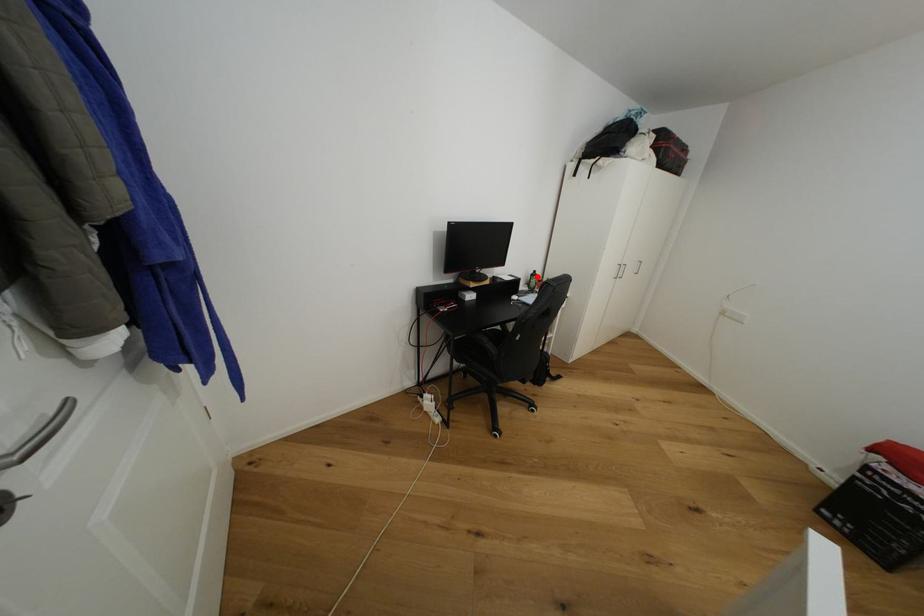
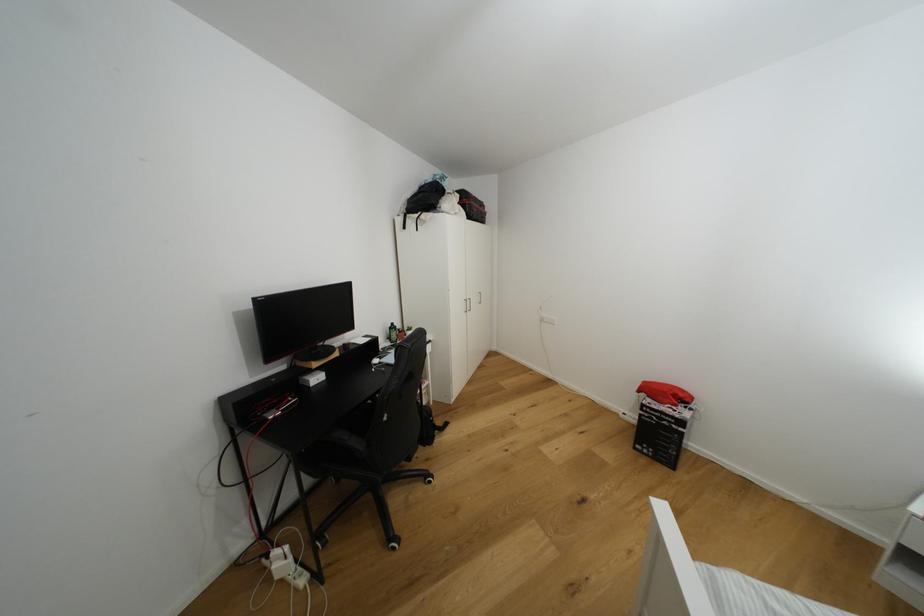
Find the pixel in the second image that matches the highlighted location in the first image.

(395, 330)